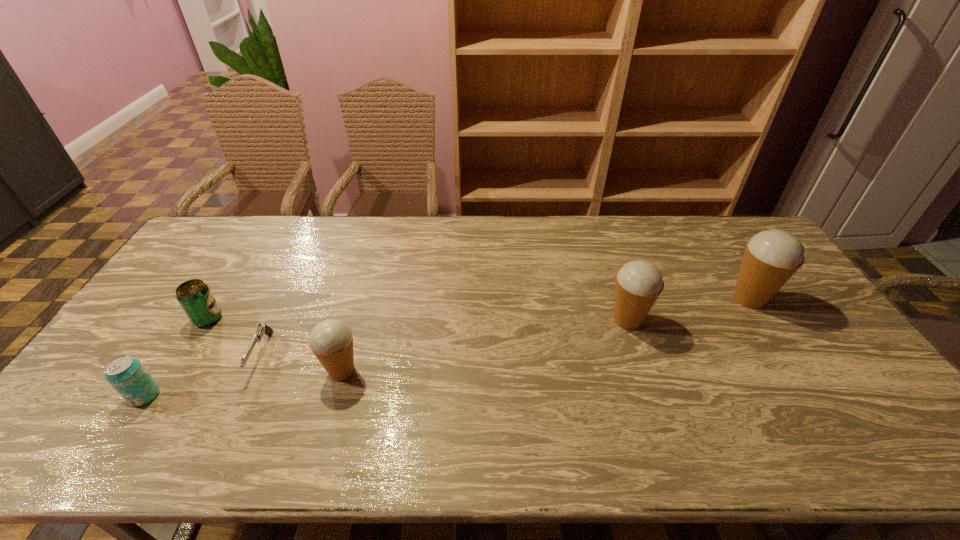
What are the coordinates of `blank space located on the right of the second object from right to left` in the screenshot? It's located at (776, 320).

This screenshot has height=540, width=960. I want to click on free spot located on the left of the rightmost icecream, so click(x=708, y=299).

Image resolution: width=960 pixels, height=540 pixels. In order to click on vacant region located 0.240m on the right of the farther beer can in this screenshot , I will do `click(303, 319)`.

Image resolution: width=960 pixels, height=540 pixels. Find the location of `vacant area situated on the front-facing side of the shortest object`. vacant area situated on the front-facing side of the shortest object is located at coordinates (240, 401).

The image size is (960, 540). What are the coordinates of `vacant space located on the right of the nearer beer can` in the screenshot? It's located at (259, 395).

Find the location of `icecream that is at the near edge`. icecream that is at the near edge is located at coordinates (331, 340).

Find the location of a particular element. Image resolution: width=960 pixels, height=540 pixels. beer can located at the near edge is located at coordinates (127, 375).

What are the coordinates of `object present at the left edge` in the screenshot? It's located at (127, 375).

The image size is (960, 540). I want to click on object present at the right edge, so click(x=771, y=257).

Where is `object that is positioned at the near left corner`? The width and height of the screenshot is (960, 540). object that is positioned at the near left corner is located at coordinates (127, 375).